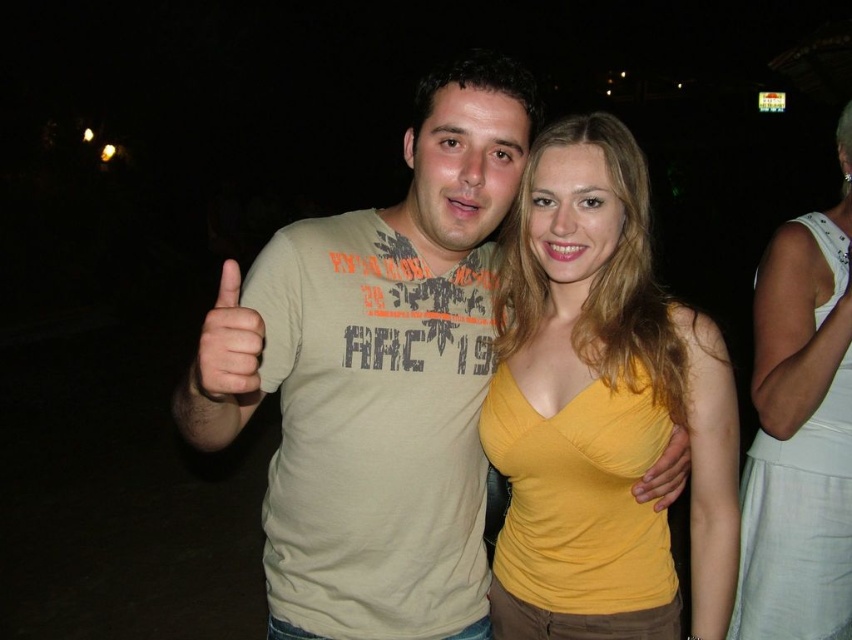
Question: Which of the following is the farthest from the observer?

Choices:
 (A) (683, 444)
 (B) (199, 342)
 (C) (734, 394)
 (D) (340, 536)

Answer: (A)

Question: Among these points, which one is farthest from the camera?

Choices:
 (A) (776, 509)
 (B) (419, 572)
 (C) (494, 616)
 (D) (226, 323)

Answer: (A)

Question: Considering the relative positions of yellow matte tank top at center and matte beige t-shirt at center in the image provided, where is yellow matte tank top at center located with respect to matte beige t-shirt at center?

Choices:
 (A) below
 (B) above

Answer: (A)

Question: Can you confirm if yellow matte tank top at center is smaller than matte beige t-shirt at center?

Choices:
 (A) no
 (B) yes

Answer: (A)

Question: Among these points, which one is farthest from the camera?

Choices:
 (A) (839, 160)
 (B) (438, 442)
 (C) (600, 358)

Answer: (A)

Question: Is white satin dress at right bigger than matte beige t-shirt at center?

Choices:
 (A) yes
 (B) no

Answer: (A)